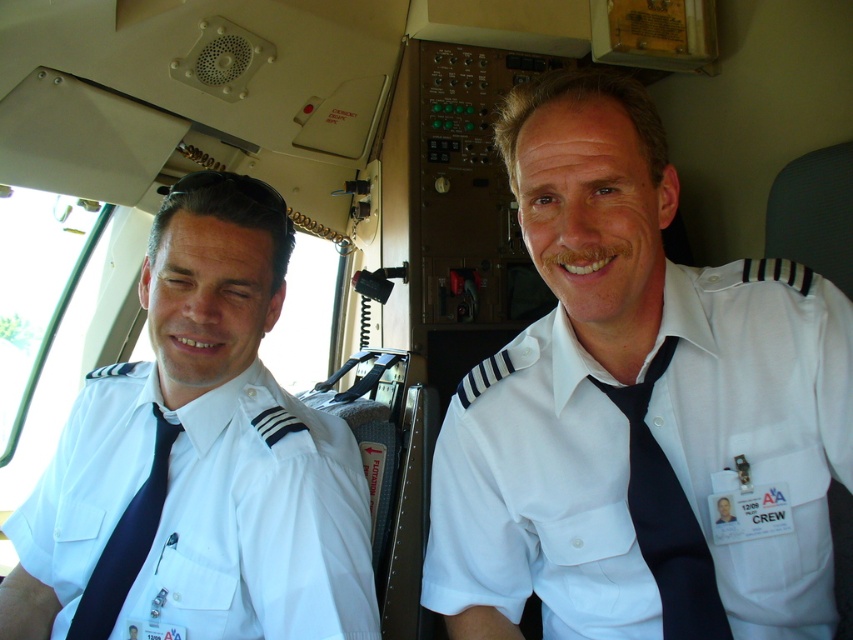
You are a flight attendant checking the cockpit for safety. You notice the white cotton shirt at left and the matte black tie at left. Which item is wider?

The white cotton shirt at left is wider than the matte black tie at left according to the description.

From the picture: You are a flight attendant who needs to reach a control panel located at point [109,451]. You are currently standing at point [677,577]. Which direction should you move to reach the control panel?

The point [109,451] is behind point [677,577], so you should move backward to reach the control panel.

From the picture: You are a flight attendant checking the cockpit before takeoff. You notice the white cotton shirt at left and the black satin tie at center. Which object is closer to you?

The white cotton shirt at left is closer to you because it is further to the viewer than the black satin tie at center.